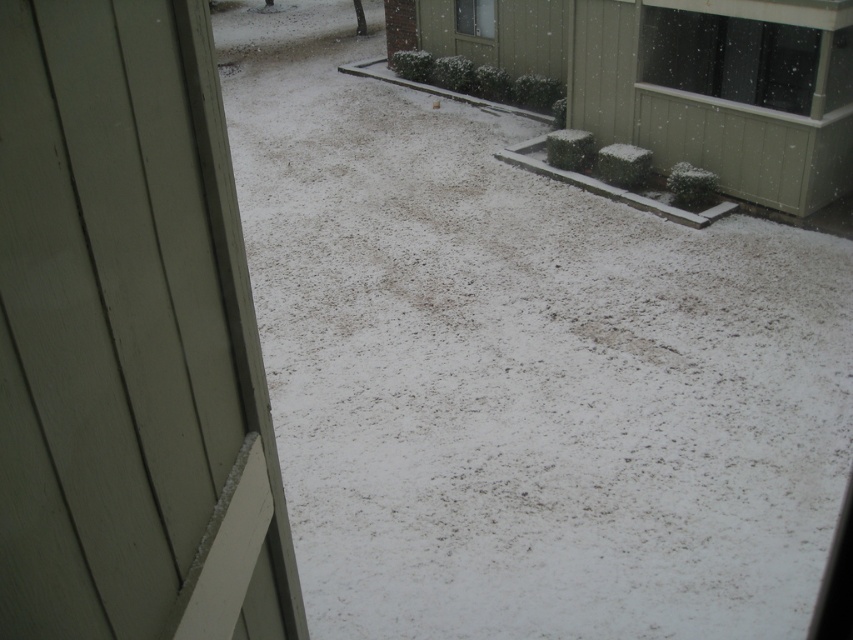
Is transparent glass window at upper right shorter than clear glass window at upper center?

No, transparent glass window at upper right is not shorter than clear glass window at upper center.

Who is positioned more to the right, transparent glass window at upper right or clear glass window at upper center?

From the viewer's perspective, transparent glass window at upper right appears more on the right side.

Is point (660, 76) closer to camera compared to point (460, 4)?

Yes, point (660, 76) is in front of point (460, 4).

Locate an element on the screen. Image resolution: width=853 pixels, height=640 pixels. transparent glass window at upper right is located at coordinates (730, 58).

Is point (216, 385) positioned behind point (840, 33)?

No, (216, 385) is closer to viewer.

Between matte green screen door at left and transparent glass window at upper right, which one is positioned lower?

matte green screen door at left is below.

Identify the location of matte green screen door at left. This screenshot has width=853, height=640. (129, 340).

Where is `matte green screen door at left`? This screenshot has width=853, height=640. matte green screen door at left is located at coordinates (129, 340).

Who is positioned more to the right, matte green screen door at left or clear glass window at upper center?

Positioned to the right is clear glass window at upper center.

This screenshot has height=640, width=853. I want to click on matte green screen door at left, so click(129, 340).